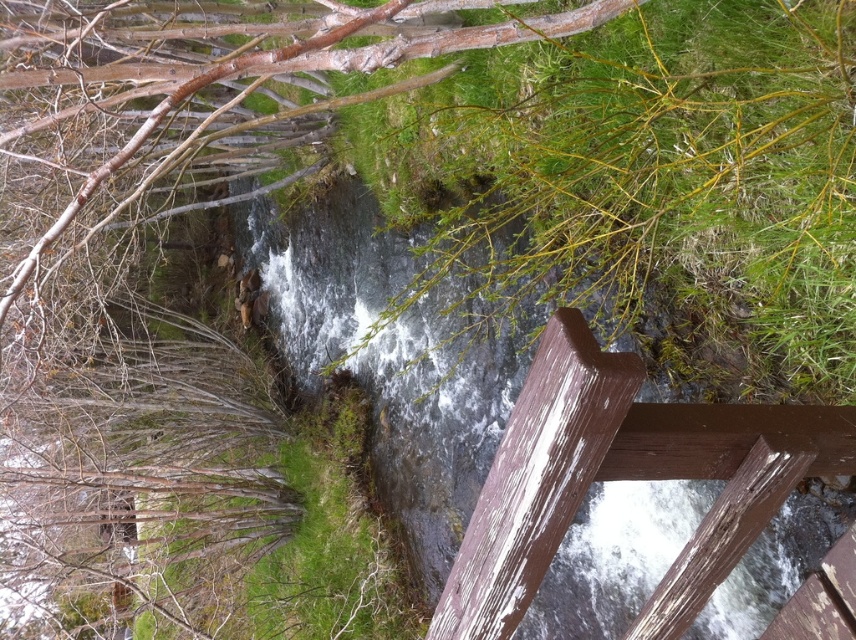
Question: Which point appears farthest from the camera in this image?

Choices:
 (A) [617, 4]
 (B) [730, 576]
 (C) [639, 472]

Answer: (B)

Question: Which object is positioned farthest from the clear water at center?

Choices:
 (A) white painted wood at center
 (B) smooth bark tree at upper left

Answer: (A)

Question: Is clear water at center above white painted wood at center?

Choices:
 (A) yes
 (B) no

Answer: (A)

Question: Is white painted wood at center to the right of smooth bark tree at upper left from the viewer's perspective?

Choices:
 (A) yes
 (B) no

Answer: (A)

Question: Is clear water at center to the right of smooth bark tree at upper left from the viewer's perspective?

Choices:
 (A) no
 (B) yes

Answer: (A)

Question: Among these points, which one is farthest from the camera?

Choices:
 (A) (724, 440)
 (B) (336, 262)
 (C) (242, 60)

Answer: (B)